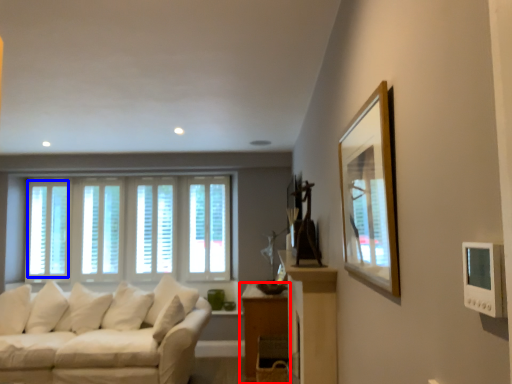
Question: Which object is closer to the camera taking this photo, table (highlighted by a red box) or window (highlighted by a blue box)?

Choices:
 (A) table
 (B) window

Answer: (A)